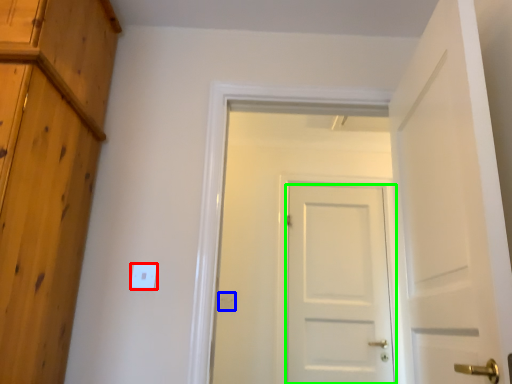
Question: Which object is the farthest from light switch (highlighted by a red box)? Choose among these: electric outlet (highlighted by a blue box) or door (highlighted by a green box).

Choices:
 (A) electric outlet
 (B) door

Answer: (B)